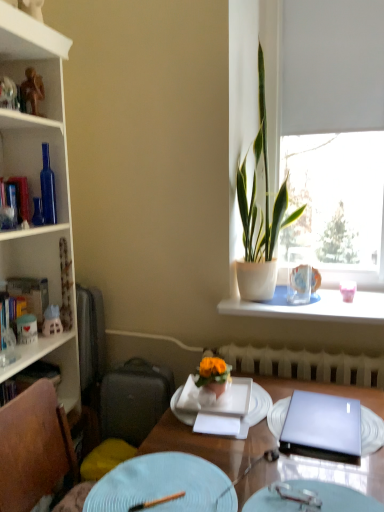
Locate an element on the screen. Image resolution: width=384 pixels, height=512 pixels. free space in front of matte pink vase at window, the third tableware in the left-to-right sequence is located at coordinates (355, 314).